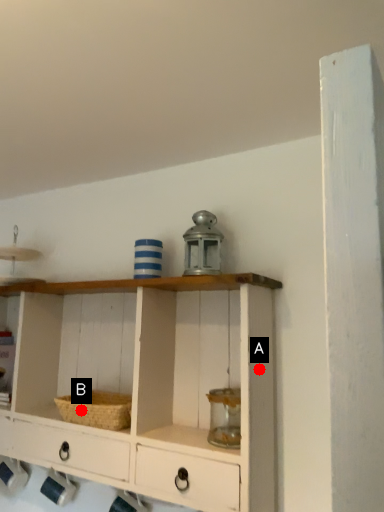
Question: Two points are circled on the image, labeled by A and B beside each circle. Which point is closer to the camera taking this photo?

Choices:
 (A) A is closer
 (B) B is closer

Answer: (A)